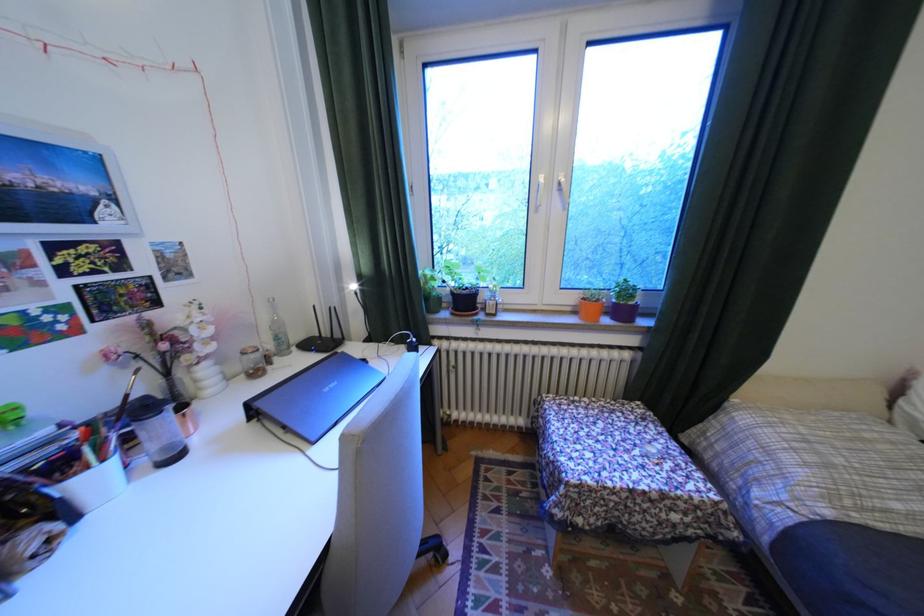
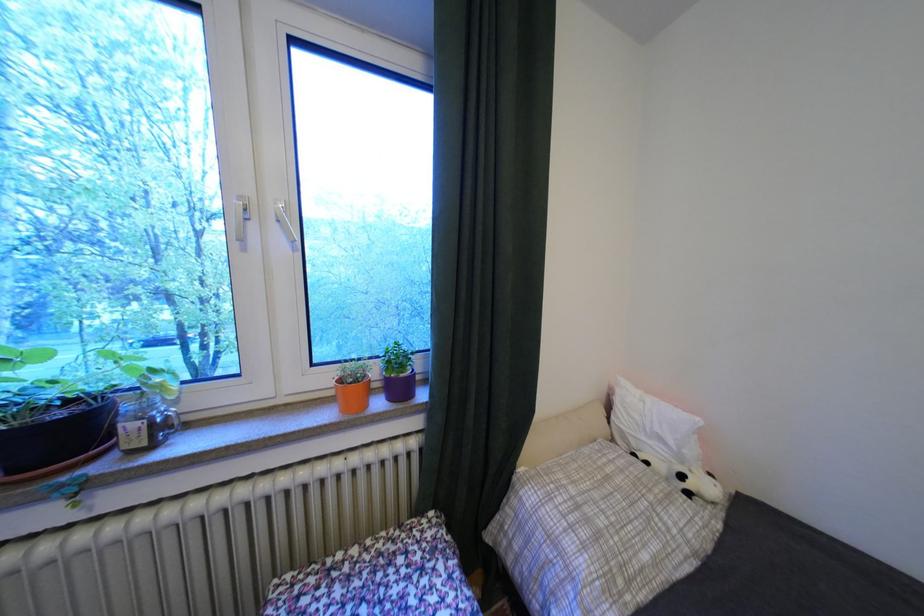
Locate, in the second image, the point that corresponds to point 478,302 in the first image.

(75, 436)